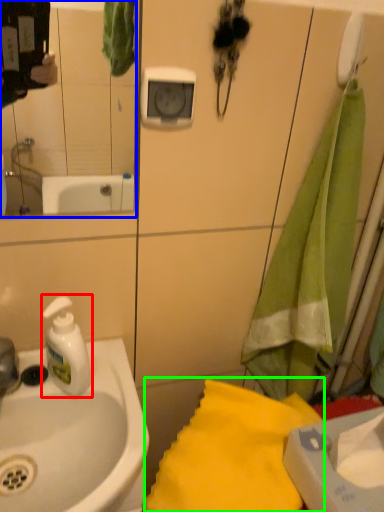
Question: Which object is positioned farthest from soap dispenser (highlighted by a red box)? Select from mirror (highlighted by a blue box) and beach towel (highlighted by a green box).

Choices:
 (A) mirror
 (B) beach towel

Answer: (A)